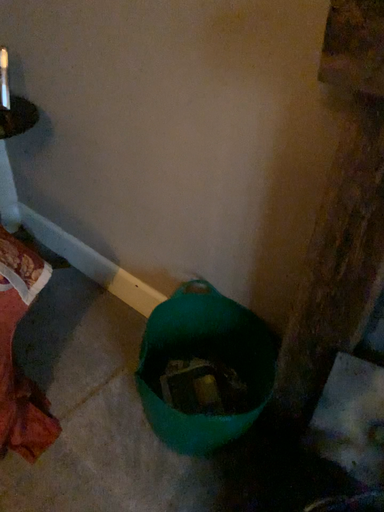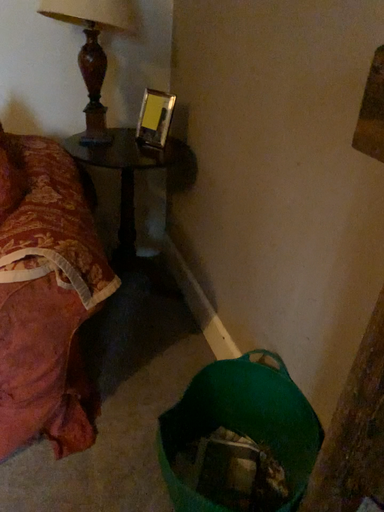
Question: Which way did the camera rotate in the video?

Choices:
 (A) rotated left
 (B) rotated right

Answer: (A)